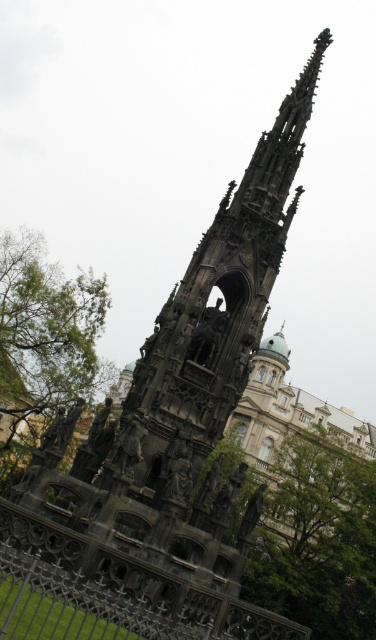
You are standing in front of the monument and notice two green leafy trees. Which tree, the green leafy tree at center or the green leafy tree at left, is positioned more to the left side of the monument?

The green leafy tree at left is positioned more to the left side of the monument.

You are standing in front of the monument and want to take a photo that includes both the green leafy tree at center and the black wrought iron fence at lower left. Which object should you position closer to the edge of the frame to ensure both fit in the shot?

Since the green leafy tree at center has a lesser width compared to the black wrought iron fence at lower left, you should position the green leafy tree at center closer to the edge of the frame to ensure both fit in the shot.

You are standing in front of the monument and want to take a photo that includes both the green leafy tree at left and the black wrought iron fence at lower left. Which object should you position closer to the left side of your camera frame to ensure both are visible?

Position the green leafy tree at left closer to the left side of your camera frame since it is already to the left of the black wrought iron fence at lower left, ensuring both are within the frame.